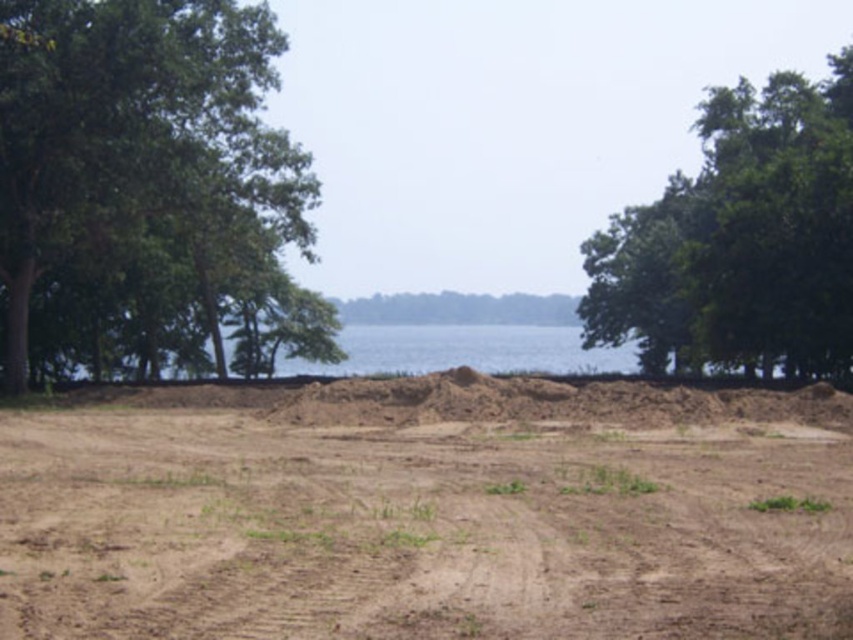
You are a hiker trying to navigate through the natural landscape. You see the green leafy tree at left and the green leafy tree at upper right. Which tree would you choose as a landmark if you want to find the taller tree?

The green leafy tree at upper right is taller than the green leafy tree at left, so you should choose the green leafy tree at upper right as your landmark.

You are standing in the open area between the green leafy tree at left and the green leafy tree at upper right. Which tree is closer to you?

The green leafy tree at left is closer to you because it is positioned under the green leafy tree at upper right, indicating it is in front.

You are a gardener planning to plant a new tree in the open area. Considering the brown sandy dirt at center and the green leafy tree at left, which location would be more suitable for planting a tree that requires well drained soil?

The brown sandy dirt at center is located below the green leafy tree at left, so it might have better drainage due to its position beneath the tree, making it more suitable for planting a tree that requires well drained soil.